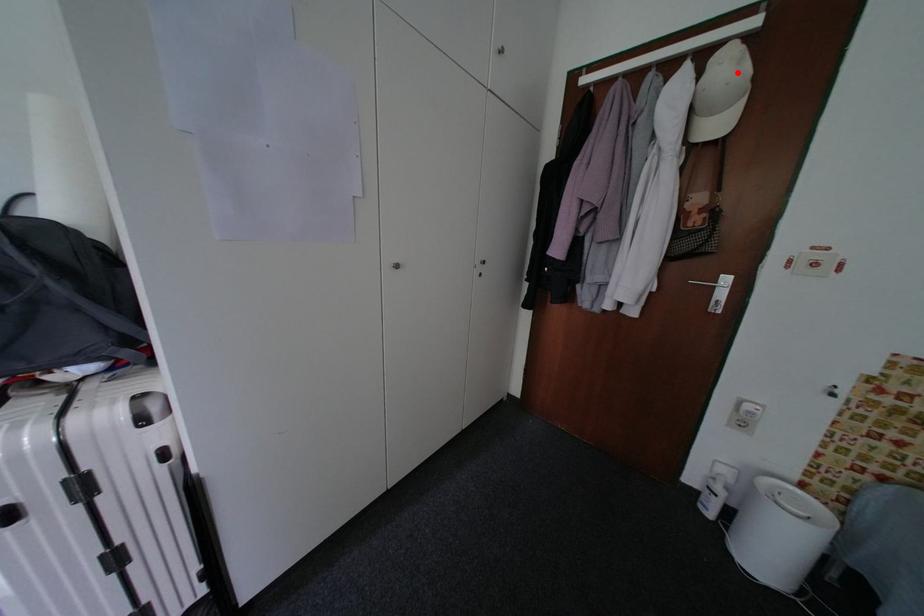
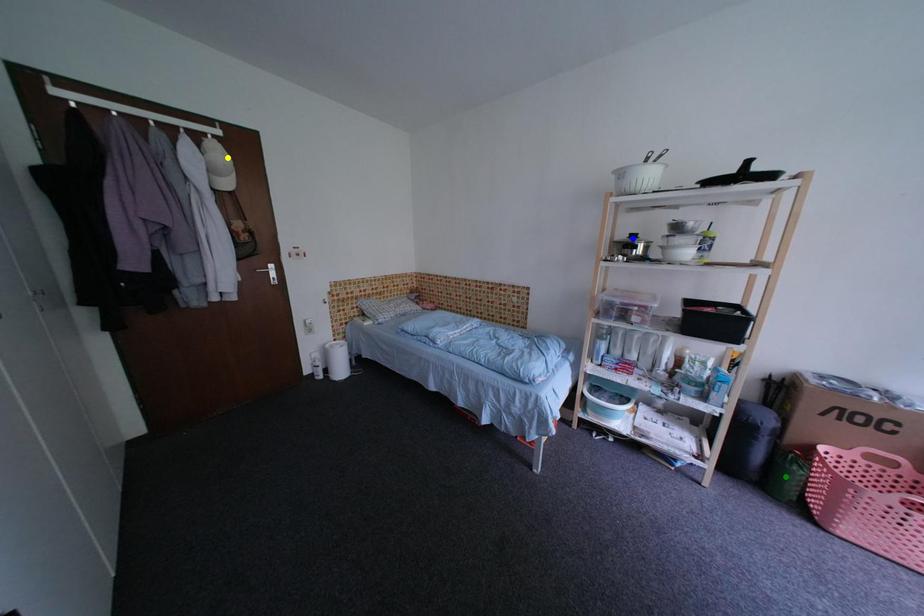
Question: I am providing you with two images of the same scene from different viewpoints. A red point is marked on the first image. You are given multiple points on the second image. Which spot in image 2 lines up with the point in image 1?

Choices:
 (A) blue point
 (B) yellow point
 (C) green point

Answer: (B)